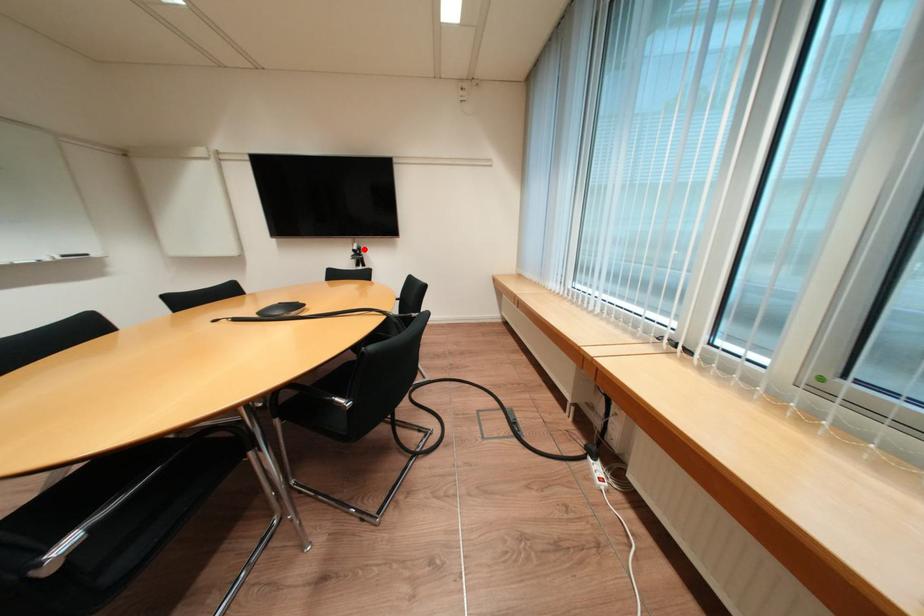
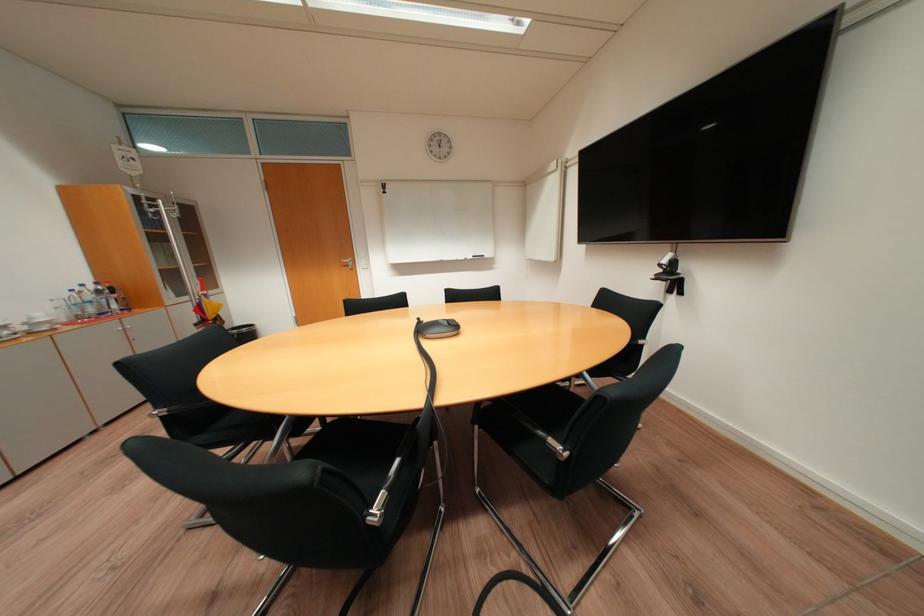
Locate, in the second image, the point that corresponds to the highlighted location in the first image.

(673, 262)